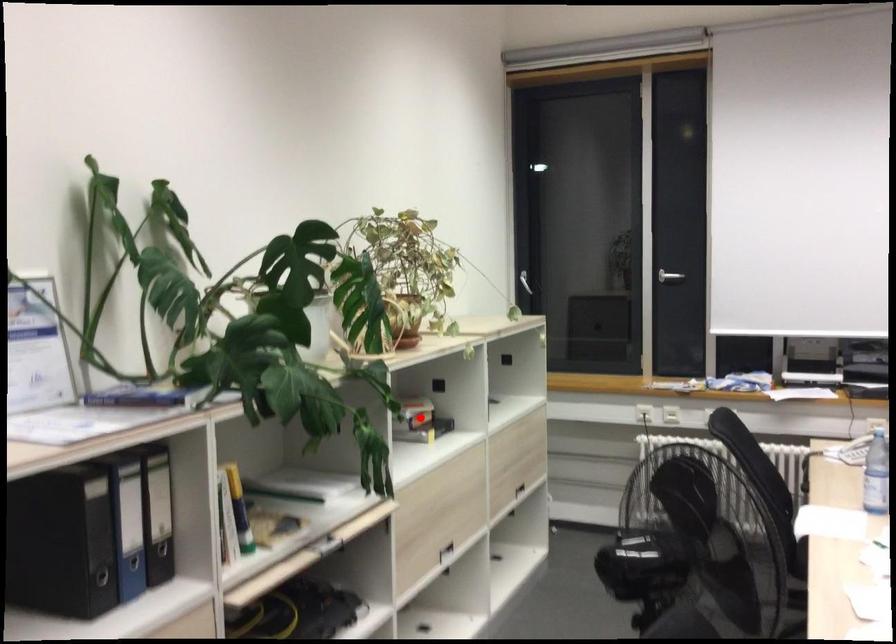
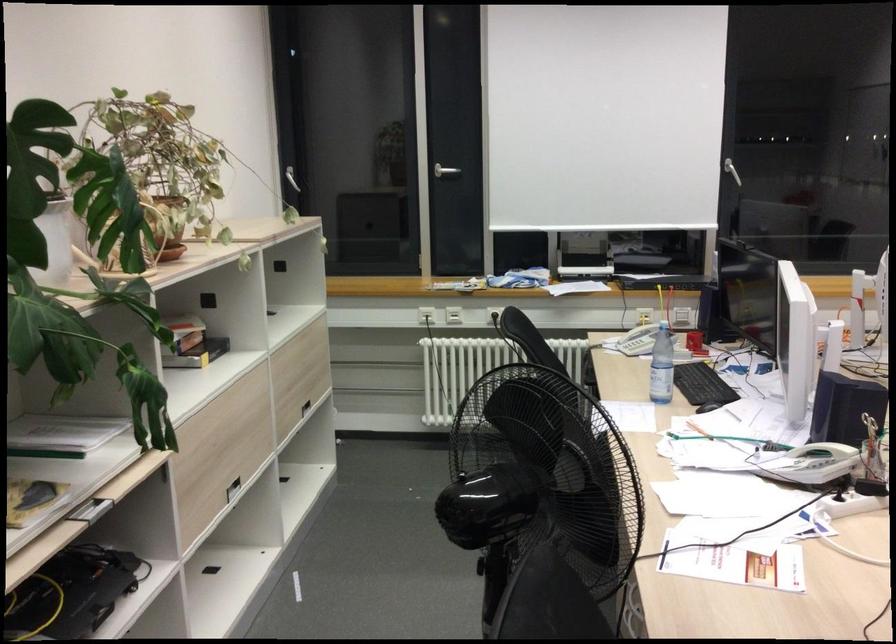
Where in the second image is the point corresponding to the highlighted location from the first image?

(192, 343)